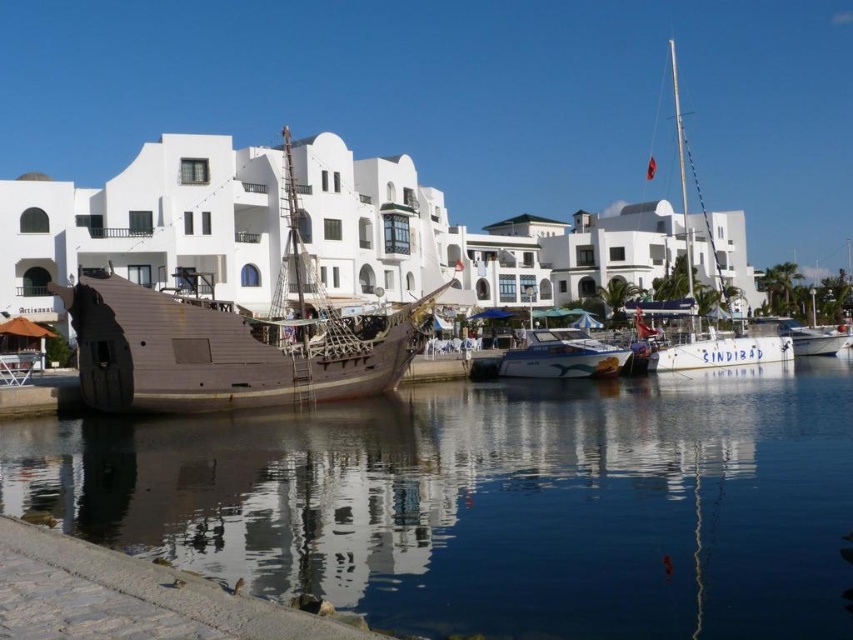
Question: Is white matte building at center closer to the viewer compared to wooden pirate ship at center?

Choices:
 (A) yes
 (B) no

Answer: (B)

Question: Which of the following is the closest to the observer?

Choices:
 (A) (238, 509)
 (B) (738, 285)
 (C) (701, 353)
 (D) (527, 337)

Answer: (A)

Question: Based on their relative distances, which object is farther from the transparent water at lower center?

Choices:
 (A) white glossy boat at center
 (B) white matte building at center
 (C) wooden pirate ship at center

Answer: (B)

Question: Can you confirm if white matte building at center is positioned to the left of white glossy boat at center?

Choices:
 (A) no
 (B) yes

Answer: (A)

Question: Does wooden pirate ship at center have a greater width compared to white glossy sailboat at center?

Choices:
 (A) no
 (B) yes

Answer: (A)

Question: Which point is closer to the camera?

Choices:
 (A) white glossy sailboat at center
 (B) white matte building at center
 (C) wooden pirate ship at center
 (D) white glossy boat at center

Answer: (C)